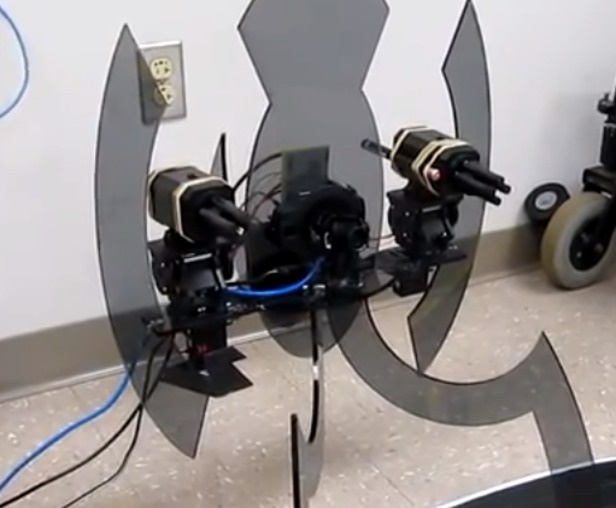
Locate an element on the screen. The width and height of the screenshot is (616, 508). black wire is located at coordinates (106, 443), (131, 452).